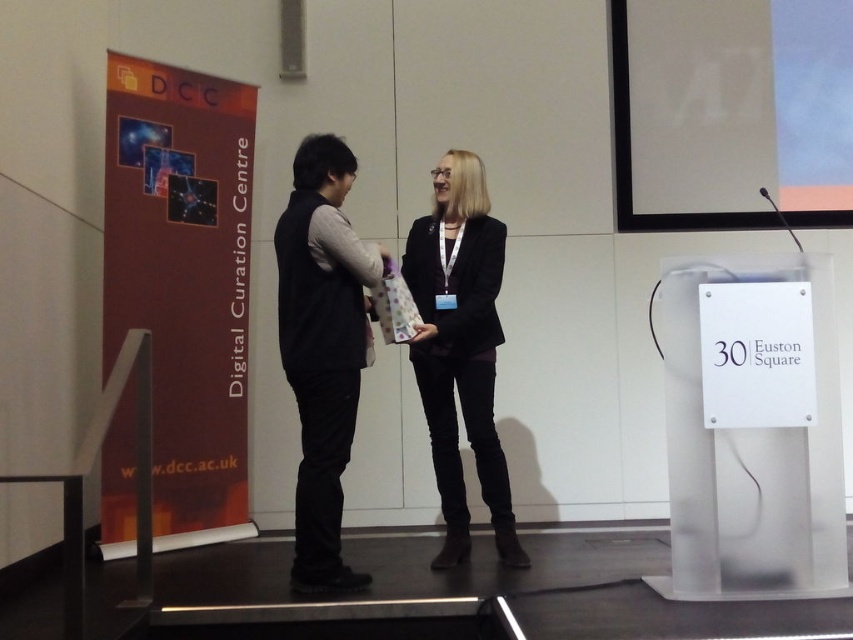
You are at a formal event and see two people exchanging a gift. The person on the left is wearing a black matte vest at center, and the person on the right is wearing a black matte blazer at center. Which clothing item is positioned to the left?

The black matte vest at center is to the left of the black matte blazer at center.

You are a photographer at the event needing to take a photo of the black matte vest at center. Your camera is 8.91 feet away from the vest. Is the distance sufficient to capture a clear, detailed image?

The black matte vest at center and camera are 8.91 feet apart, so the distance is sufficient to capture a clear, detailed image.

You are standing at the origin of the coordinate system in the image. There are two points marked in the scene. The first point is at coordinates point [334,147] and the second point is at coordinates point [485,285]. Which point is closer to you?

Point [334,147] is closer to you because it is in front of point [485,285].